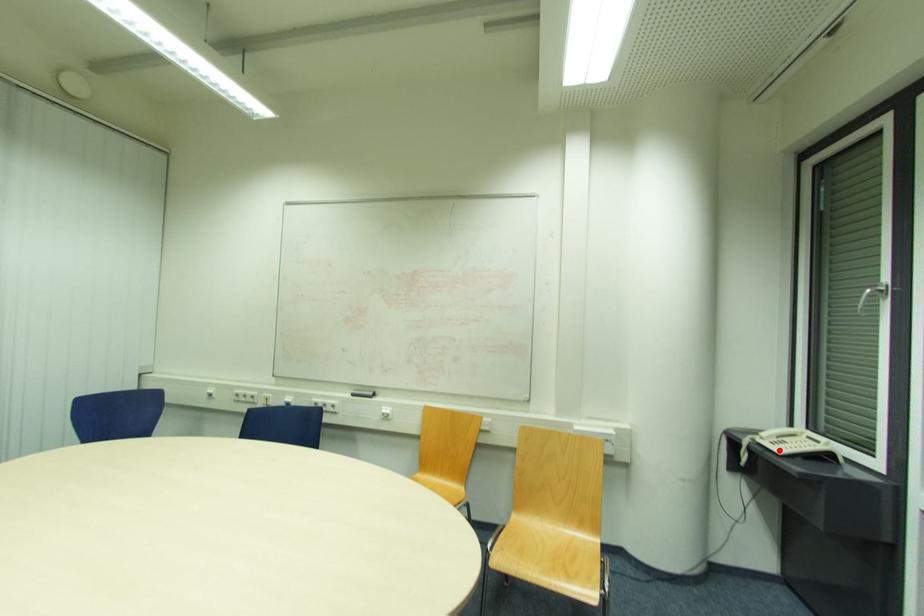
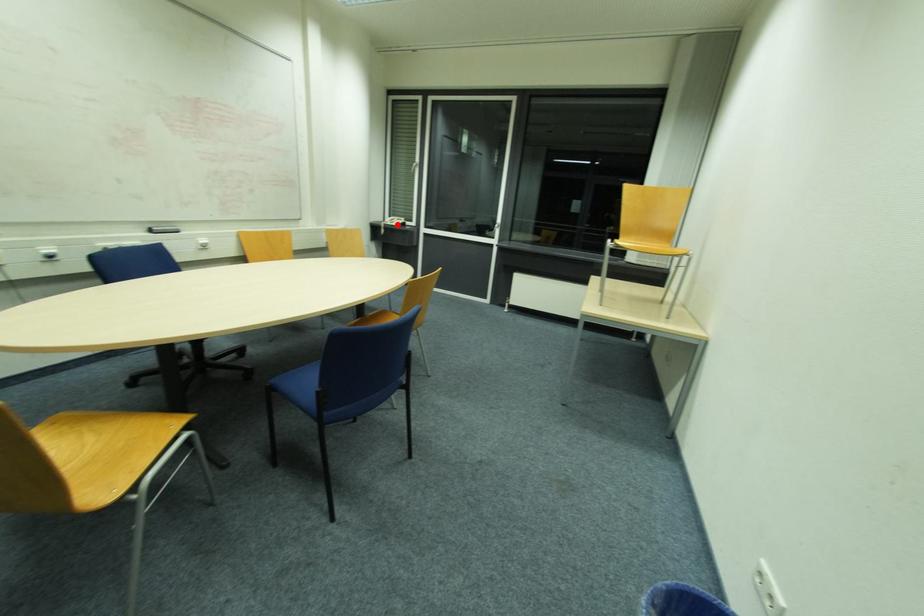
I am providing you with two images of the same scene from different viewpoints. A red point is marked on the first image and another point is marked on the second image. Is the marked point in image1 the same physical position as the marked point in image2?

Yes